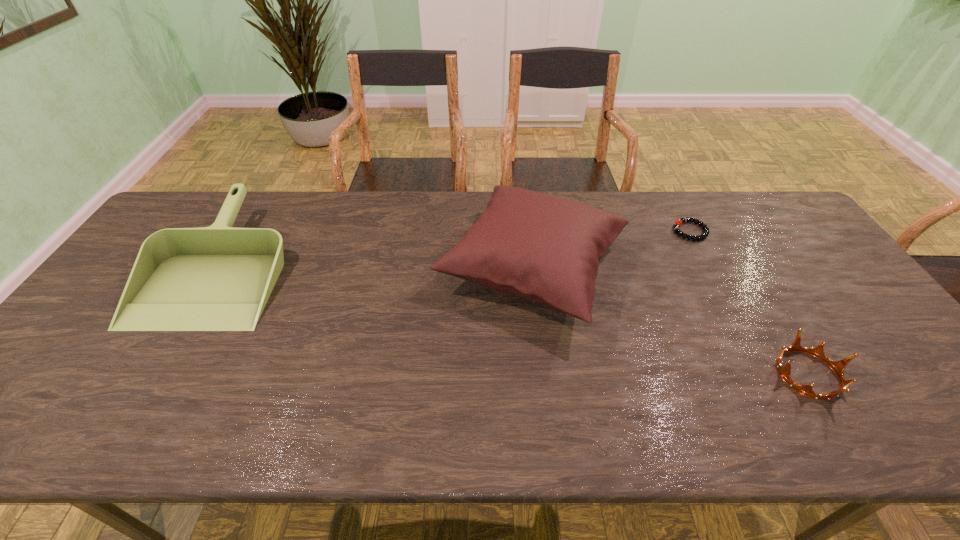
At what (x,y) coordinates should I click in order to perform the action: click on object that ranks as the second closest to the tallest object. Please return your answer as a coordinate pair (x, y). Looking at the image, I should click on (838, 367).

At what (x,y) coordinates should I click in order to perform the action: click on object that can be found as the third closest to the crown. Please return your answer as a coordinate pair (x, y). Looking at the image, I should click on (218, 278).

The image size is (960, 540). What are the coordinates of `free space that satisfies the following two spatial constraints: 1. on the scoop of the crown; 2. on the left side of the third shortest object` in the screenshot? It's located at (155, 374).

The width and height of the screenshot is (960, 540). Find the location of `vacant space that satisfies the following two spatial constraints: 1. on the back side of the tallest object; 2. on the right side of the shortest object`. vacant space that satisfies the following two spatial constraints: 1. on the back side of the tallest object; 2. on the right side of the shortest object is located at coordinates (528, 231).

The width and height of the screenshot is (960, 540). What are the coordinates of `vacant space that satisfies the following two spatial constraints: 1. on the back side of the cushion; 2. on the right side of the shortest object` in the screenshot? It's located at (528, 231).

This screenshot has width=960, height=540. Find the location of `vacant point that satisfies the following two spatial constraints: 1. on the scoop of the second shortest object; 2. on the left side of the dustpan`. vacant point that satisfies the following two spatial constraints: 1. on the scoop of the second shortest object; 2. on the left side of the dustpan is located at coordinates (155, 374).

Identify the location of vacant position in the image that satisfies the following two spatial constraints: 1. on the back side of the shortest object; 2. on the right side of the cushion. The width and height of the screenshot is (960, 540). (528, 231).

Identify the location of vacant space that satisfies the following two spatial constraints: 1. on the front side of the tallest object; 2. on the left side of the second shortest object. (546, 374).

You are a GUI agent. You are given a task and a screenshot of the screen. Output one action in this format:
    pyautogui.click(x=<x>, y=<y>)
    Task: Click on the free space that satisfies the following two spatial constraints: 1. on the front side of the tallest object; 2. on the left side of the crown
    
    Given the screenshot: What is the action you would take?
    [x=546, y=374]

This screenshot has width=960, height=540. I want to click on blank space that satisfies the following two spatial constraints: 1. on the scoop of the dustpan; 2. on the right side of the third tallest object, so click(x=155, y=374).